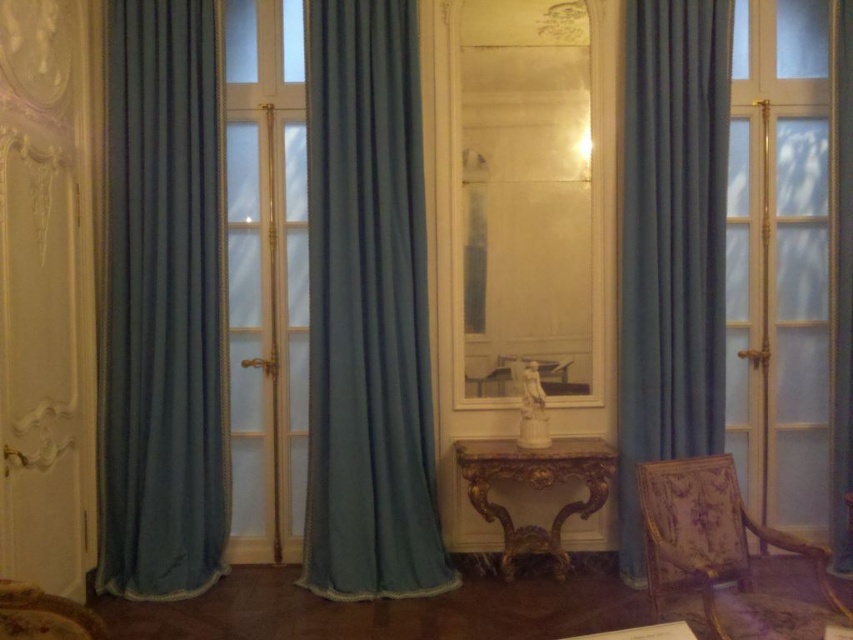
You are a GUI agent. You are given a task and a screenshot of the screen. Output one action in this format:
    pyautogui.click(x=<x>, y=<y>)
    Task: Click on the clear glass mirror at center
    The width and height of the screenshot is (853, 640).
    Given the screenshot: What is the action you would take?
    pyautogui.click(x=529, y=193)

Does point (125, 428) come in front of point (695, 540)?

No, it is not.

How distant is teal fabric curtain at left from patterned fabric armchair at lower right?

2.31 meters

Which is in front, point (119, 161) or point (724, 545)?

Positioned in front is point (724, 545).

This screenshot has height=640, width=853. Identify the location of teal fabric curtain at left. (163, 305).

Looking at this image, which is below, teal velvet curtain at center or clear glass mirror at center?

Positioned lower is teal velvet curtain at center.

Image resolution: width=853 pixels, height=640 pixels. What are the coordinates of `teal velvet curtain at center` in the screenshot? It's located at (367, 310).

Is point (397, 440) positioned after point (550, 227)?

No, it is not.

Identify the location of teal velvet curtain at center. This screenshot has height=640, width=853. (x=367, y=310).